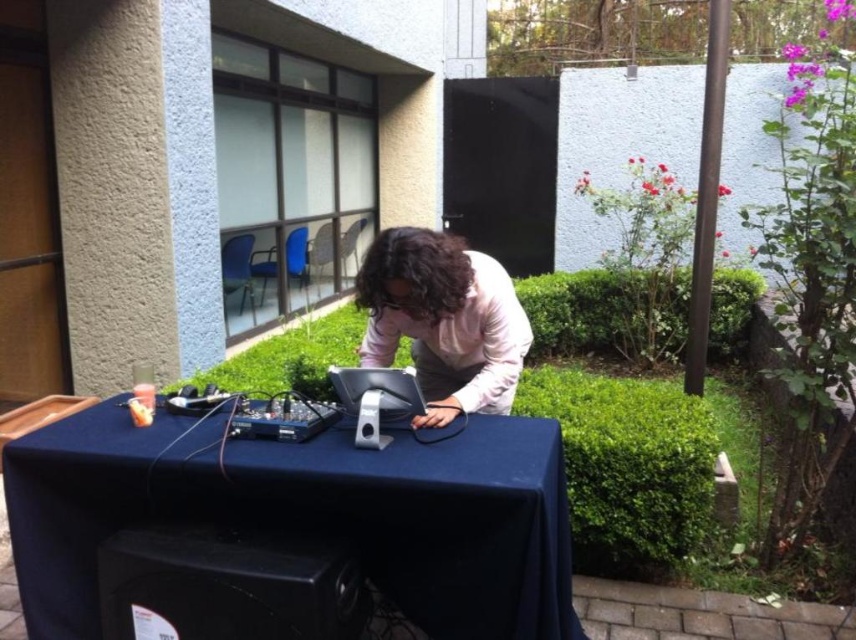
Does point (331, 579) come farther from viewer compared to point (381, 260)?

No, (331, 579) is in front of (381, 260).

This screenshot has width=856, height=640. I want to click on black plastic speaker at lower center, so click(229, 586).

Identify the location of black plastic speaker at lower center. Image resolution: width=856 pixels, height=640 pixels. (229, 586).

Does blue fabric table at center have a smaller size compared to pink matte shirt at center?

No.

Is blue fabric table at center behind pink matte shirt at center?

No, blue fabric table at center is in front of pink matte shirt at center.

Who is more forward, (x=348, y=452) or (x=397, y=259)?

Point (x=348, y=452) is in front.

Find the location of `blue fabric table at center`. blue fabric table at center is located at coordinates (307, 513).

Is blue fabric table at center closer to camera compared to metallic silver laptop at center?

Yes, it is.

Between point (206, 515) and point (334, 380), which one is positioned behind?

The point (334, 380) is more distant.

Who is more distant from viewer, (x=568, y=563) or (x=400, y=371)?

Positioned behind is point (x=568, y=563).

The width and height of the screenshot is (856, 640). In order to click on blue fabric table at center in this screenshot , I will do `click(307, 513)`.